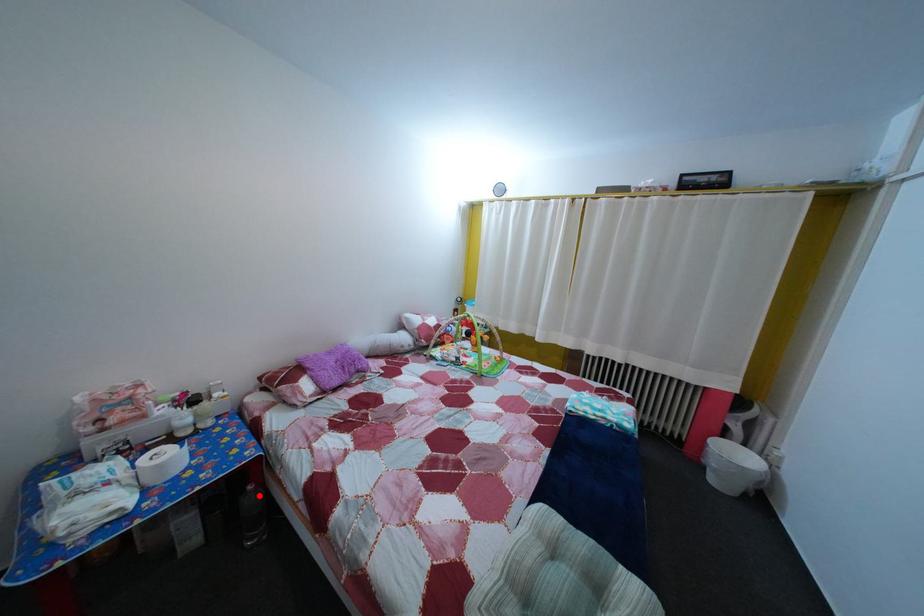
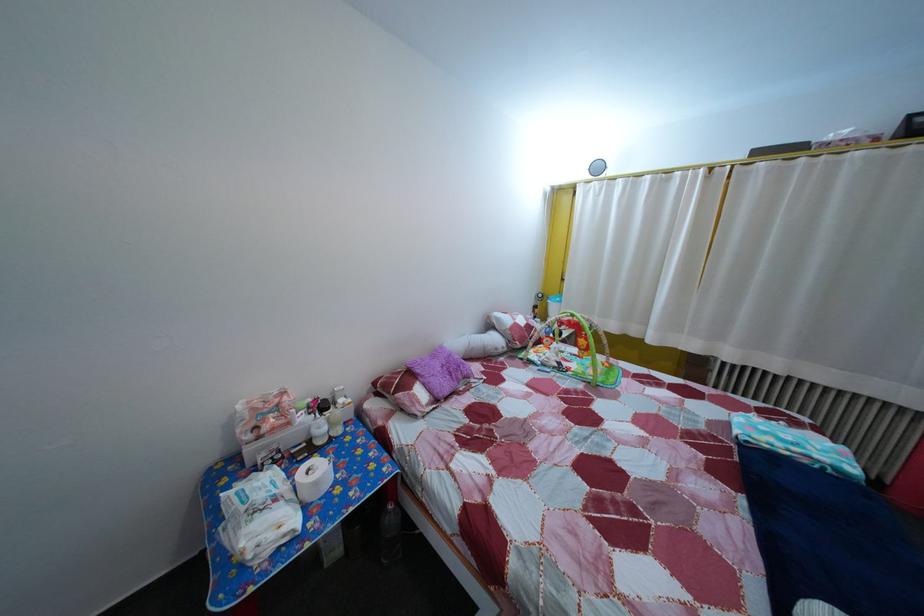
Question: A red point is marked in image1. In image2, is the corresponding 3D point closer to the camera or farther? Reply with the corresponding letter.

Choices:
 (A) The corresponding 3D point is closer.
 (B) The corresponding 3D point is farther.

Answer: (B)